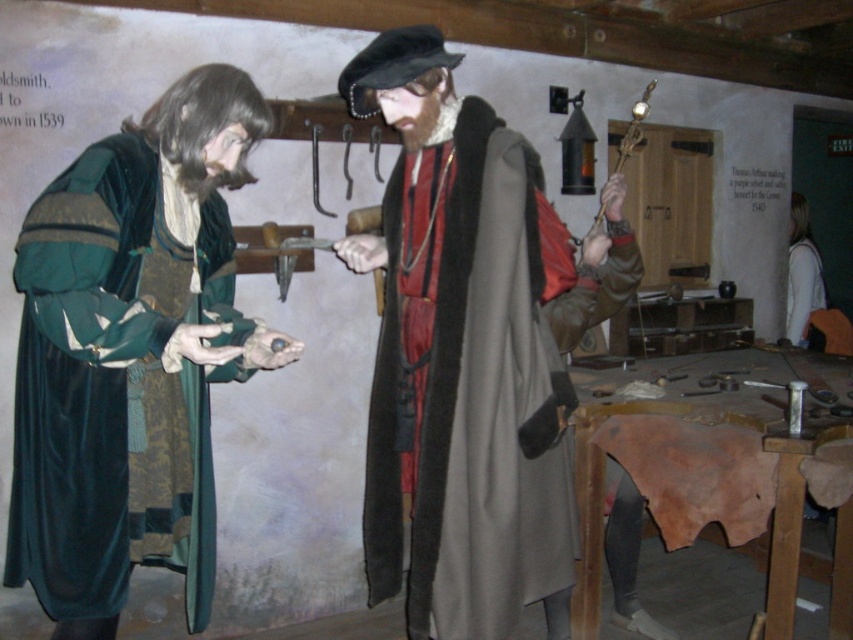
Does velvet green robe at left appear on the right side of dark gray woolen cloak at center?

No, velvet green robe at left is not to the right of dark gray woolen cloak at center.

This screenshot has height=640, width=853. I want to click on velvet green robe at left, so click(x=131, y=355).

Which is above, dark gray woolen cloak at center or white fabric shirt at right?

Positioned higher is white fabric shirt at right.

Can you confirm if dark gray woolen cloak at center is positioned to the right of white fabric shirt at right?

No, dark gray woolen cloak at center is not to the right of white fabric shirt at right.

Locate an element on the screen. Image resolution: width=853 pixels, height=640 pixels. dark gray woolen cloak at center is located at coordinates (471, 401).

Locate an element on the screen. dark gray woolen cloak at center is located at coordinates (471, 401).

Between velvet green robe at left and white fabric shirt at right, which one appears on the left side from the viewer's perspective?

velvet green robe at left is more to the left.

Does velvet green robe at left have a larger size compared to white fabric shirt at right?

Correct, velvet green robe at left is larger in size than white fabric shirt at right.

Who is more distant from viewer, (144, 525) or (793, 314)?

Point (793, 314)

The width and height of the screenshot is (853, 640). In order to click on velvet green robe at left in this screenshot , I will do `click(131, 355)`.